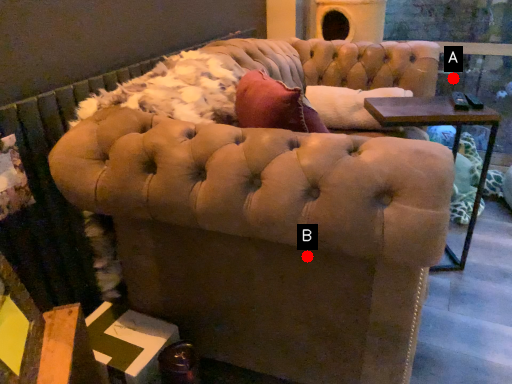
Question: Two points are circled on the image, labeled by A and B beside each circle. Which point is further to the camera?

Choices:
 (A) A is further
 (B) B is further

Answer: (A)